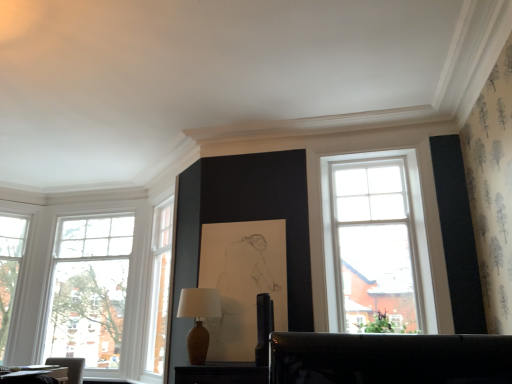
Question: Considering the relative positions of wooden table at lower left and matte brown vase at center in the image provided, is wooden table at lower left to the right of matte brown vase at center from the viewer's perspective?

Choices:
 (A) no
 (B) yes

Answer: (A)

Question: Are wooden table at lower left and matte brown vase at center making contact?

Choices:
 (A) yes
 (B) no

Answer: (B)

Question: From a real-world perspective, does wooden table at lower left stand above matte brown vase at center?

Choices:
 (A) no
 (B) yes

Answer: (A)

Question: Is wooden table at lower left turned away from matte brown vase at center?

Choices:
 (A) yes
 (B) no

Answer: (B)

Question: Can we say wooden table at lower left lies outside matte brown vase at center?

Choices:
 (A) yes
 (B) no

Answer: (A)

Question: Choose the correct answer: Is white glass window at left, which is the 2th window from right to left, inside matte brown vase at center or outside it?

Choices:
 (A) outside
 (B) inside

Answer: (A)

Question: Looking at their shapes, would you say white glass window at left, which is the 2th window from right to left, is wider or thinner than matte brown vase at center?

Choices:
 (A) thin
 (B) wide

Answer: (B)

Question: In the image, is white glass window at left, marked as the 1th window in a left-to-right arrangement, on the left side or the right side of matte brown vase at center?

Choices:
 (A) left
 (B) right

Answer: (A)

Question: From a real-world perspective, is white glass window at left, which is the 2th window from right to left, physically located above or below matte brown vase at center?

Choices:
 (A) below
 (B) above

Answer: (B)

Question: Based on their sizes in the image, would you say wooden table at lower left is bigger or smaller than matte brown vase at center?

Choices:
 (A) big
 (B) small

Answer: (B)

Question: From the image's perspective, is wooden table at lower left above or below matte brown vase at center?

Choices:
 (A) below
 (B) above

Answer: (A)

Question: Is wooden table at lower left wider or thinner than matte brown vase at center?

Choices:
 (A) thin
 (B) wide

Answer: (B)

Question: Is wooden table at lower left taller or shorter than matte brown vase at center?

Choices:
 (A) short
 (B) tall

Answer: (A)

Question: Does point (51, 317) appear closer or farther from the camera than point (205, 342)?

Choices:
 (A) farther
 (B) closer

Answer: (A)

Question: Considering the positions of clear glass window at left, the first window viewed from the right, and matte brown vase at center in the image, is clear glass window at left, the first window viewed from the right, wider or thinner than matte brown vase at center?

Choices:
 (A) wide
 (B) thin

Answer: (B)